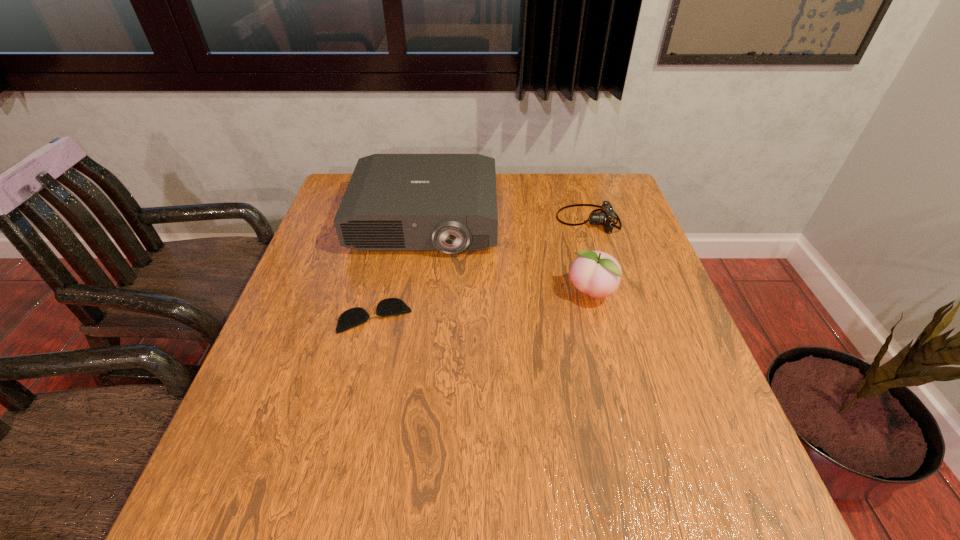
The height and width of the screenshot is (540, 960). In order to click on projector that is at the far edge in this screenshot , I will do `click(394, 202)`.

Where is `camera located in the far edge section of the desktop`? The width and height of the screenshot is (960, 540). camera located in the far edge section of the desktop is located at coordinates (606, 217).

Identify the location of projector that is at the left edge. The height and width of the screenshot is (540, 960). (394, 202).

Image resolution: width=960 pixels, height=540 pixels. In order to click on spectacles located at the left edge in this screenshot , I will do `click(350, 318)`.

Locate an element on the screen. The width and height of the screenshot is (960, 540). peach at the right edge is located at coordinates (595, 273).

This screenshot has width=960, height=540. Find the location of `camera present at the right edge`. camera present at the right edge is located at coordinates point(606,217).

The height and width of the screenshot is (540, 960). Identify the location of object present at the far left corner. (394, 202).

Find the location of a particular element. object present at the far right corner is located at coordinates (606, 217).

In the image, there is a desktop. At what (x,y) coordinates should I click in order to perform the action: click on vacant space at the far edge. Please return your answer as a coordinate pair (x, y). Looking at the image, I should click on (545, 208).

Identify the location of vacant space at the near edge. (378, 515).